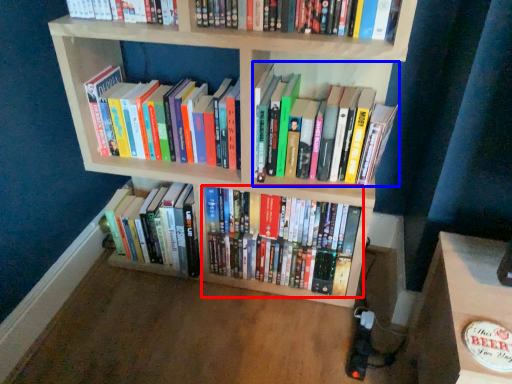
Question: Which of the following is the closest to the observer, book (highlighted by a red box) or book (highlighted by a blue box)?

Choices:
 (A) book
 (B) book

Answer: (B)